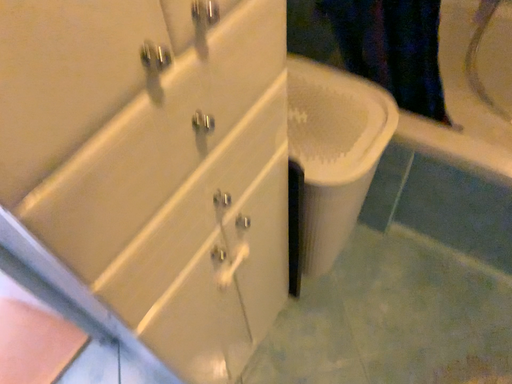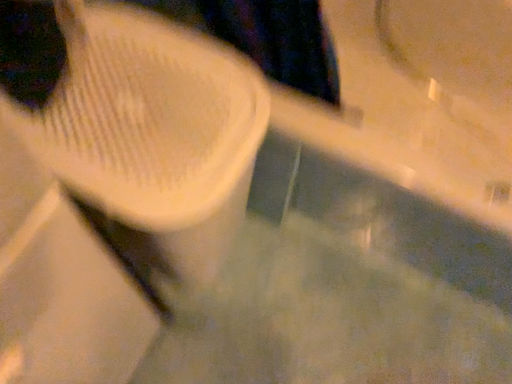
Question: Which way did the camera rotate in the video?

Choices:
 (A) rotated left
 (B) rotated right

Answer: (B)